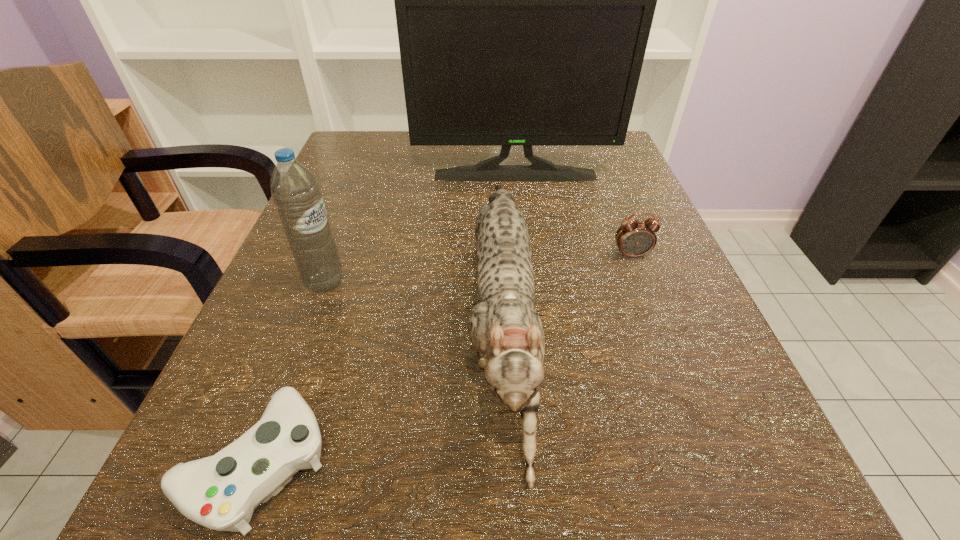
Where is `unoccupied position between the farthest object and the water bottle`? unoccupied position between the farthest object and the water bottle is located at coordinates (420, 228).

I want to click on empty location between the farthest object and the second shortest object, so click(573, 215).

Locate an element on the screen. The height and width of the screenshot is (540, 960). free point between the cat and the water bottle is located at coordinates (413, 306).

Locate an element on the screen. The height and width of the screenshot is (540, 960). vacant space that is in between the tallest object and the second shortest object is located at coordinates (573, 215).

You are a GUI agent. You are given a task and a screenshot of the screen. Output one action in this format:
    pyautogui.click(x=<x>, y=<y>)
    Task: Click on the free space between the tallest object and the alarm clock
    The width and height of the screenshot is (960, 540).
    Given the screenshot: What is the action you would take?
    pyautogui.click(x=573, y=215)

Locate which object ranks fourth in proximity to the water bottle. Please provide its 2D coordinates. Your answer should be formatted as a tuple, i.e. [(x, y)], where the tuple contains the x and y coordinates of a point satisfying the conditions above.

[(635, 238)]

Where is `object that stands as the second closest to the cat`? object that stands as the second closest to the cat is located at coordinates 220,492.